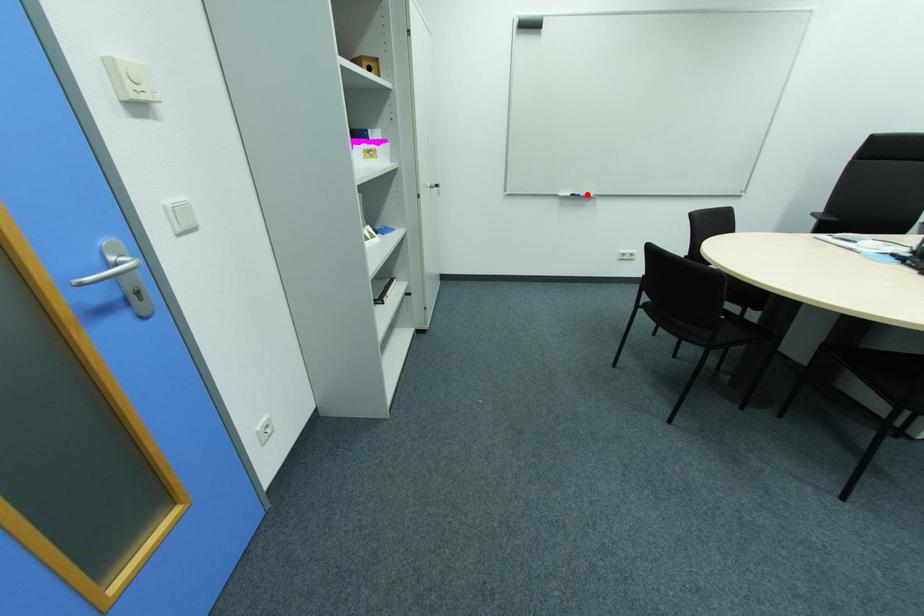
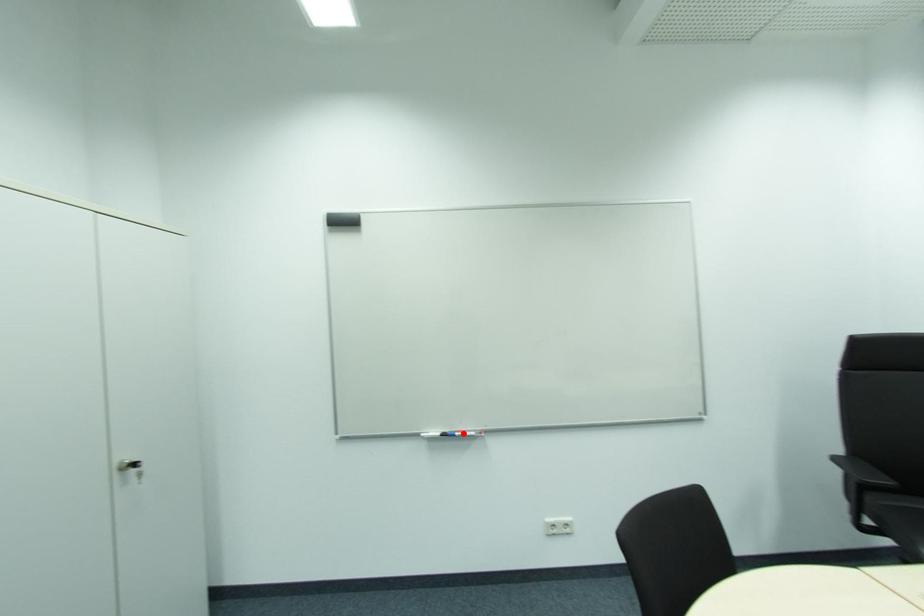
I am providing you with two images of the same scene from different viewpoints. A red point is marked on the first image and another point is marked on the second image. Is the red point in image1 aligned with the point shown in image2?

Yes